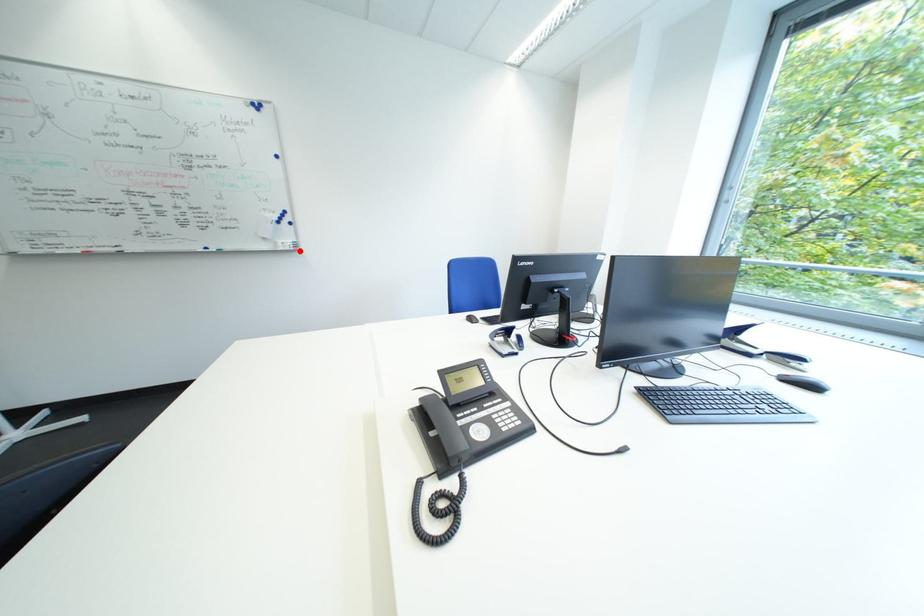
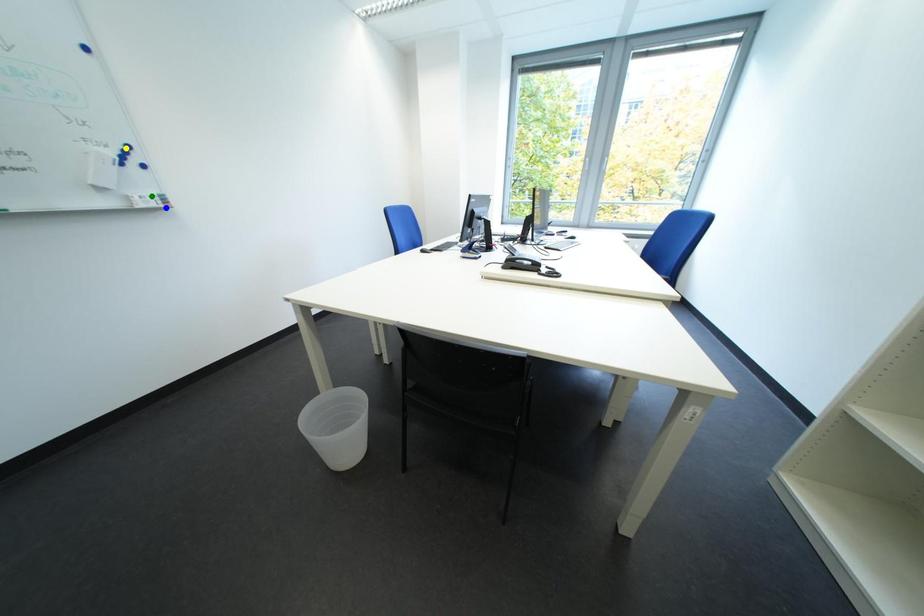
Question: I am providing you with two images of the same scene from different viewpoints. A red point is marked on the first image. You are given multiple points on the second image. Which mark in image 2 goes with the point in image 1?

Choices:
 (A) green point
 (B) blue point
 (C) yellow point

Answer: (B)